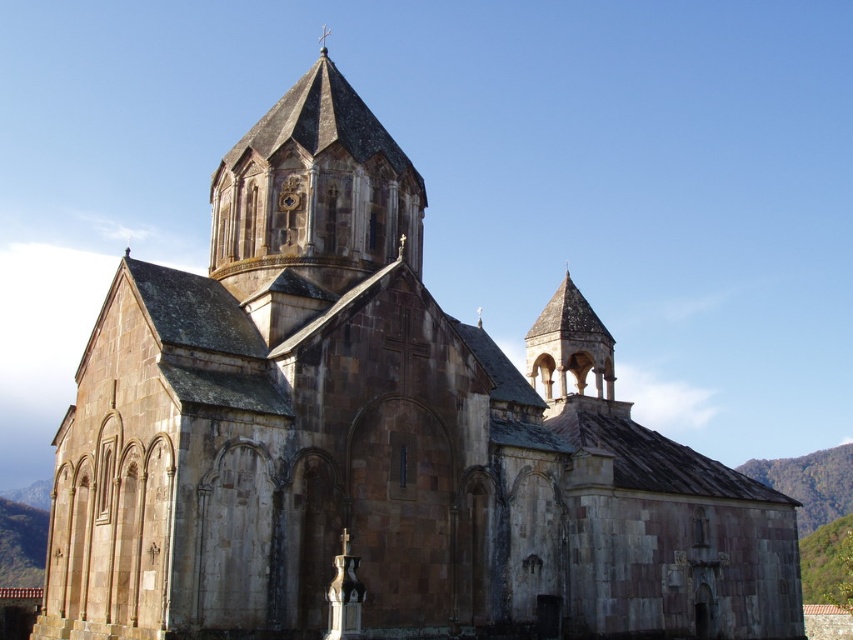
Describe the element at coordinates (314, 193) in the screenshot. I see `brown stone tower at center` at that location.

Which is behind, point (334, 278) or point (328, 28)?

The point (328, 28) is behind.

Image resolution: width=853 pixels, height=640 pixels. Find the location of `brown stone tower at center`. brown stone tower at center is located at coordinates (314, 193).